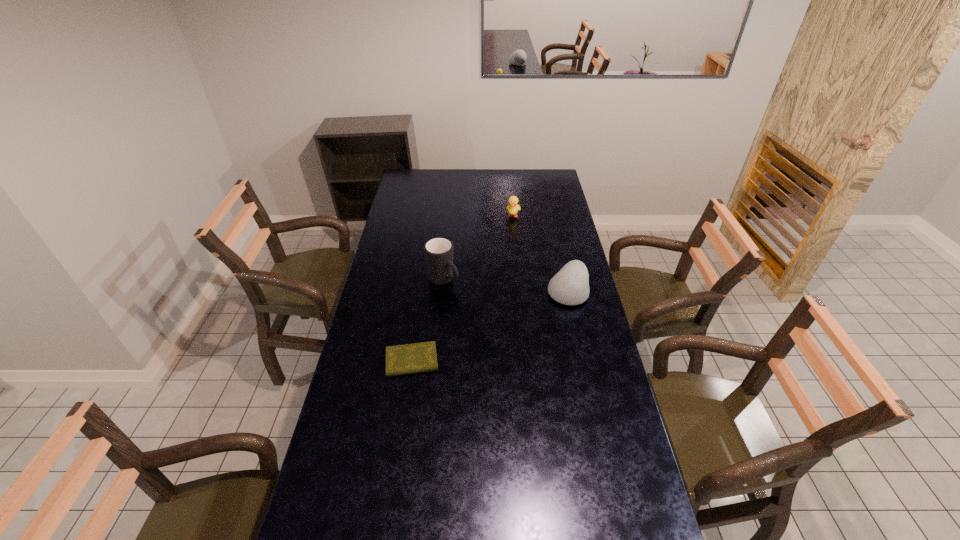
I want to click on object identified as the closest to the beanie, so click(x=438, y=251).

Select which object is the closest to the mug. Please provide its 2D coordinates. Your answer should be formatted as a tuple, i.e. [(x, y)], where the tuple contains the x and y coordinates of a point satisfying the conditions above.

[(405, 359)]

You are a GUI agent. You are given a task and a screenshot of the screen. Output one action in this format:
    pyautogui.click(x=<x>, y=<y>)
    Task: Click on the vacant space that satisfies the following two spatial constraints: 1. on the front side of the farthest object; 2. on the left side of the beanie
    The height and width of the screenshot is (540, 960).
    Given the screenshot: What is the action you would take?
    pyautogui.click(x=521, y=291)

Identify the location of free space that satisfies the following two spatial constraints: 1. on the back side of the farthest object; 2. on the right side of the tallest object. (449, 215).

This screenshot has height=540, width=960. I want to click on blank area in the image that satisfies the following two spatial constraints: 1. on the back side of the mug; 2. on the left side of the diary, so click(x=423, y=281).

Where is `free space that satisfies the following two spatial constraints: 1. on the back side of the rightmost object; 2. on the right side of the shortest object`? The height and width of the screenshot is (540, 960). free space that satisfies the following two spatial constraints: 1. on the back side of the rightmost object; 2. on the right side of the shortest object is located at coordinates (422, 291).

The width and height of the screenshot is (960, 540). I want to click on free location that satisfies the following two spatial constraints: 1. on the back side of the second object from right to left; 2. on the right side of the diary, so click(433, 215).